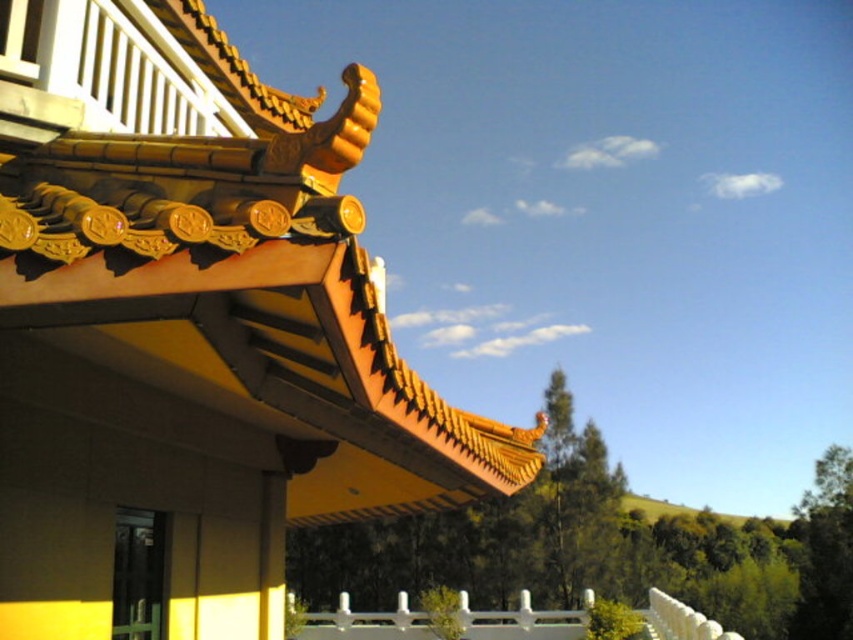
You are standing in front of the traditional East Asian building with the curved orange roof. You notice two points marked on the wall. One is at coordinate point (235, 81) and the other at point (579, 609). Which of these two points is closer to you?

Point (235, 81) is in front of point (579, 609), so it is closer to you.